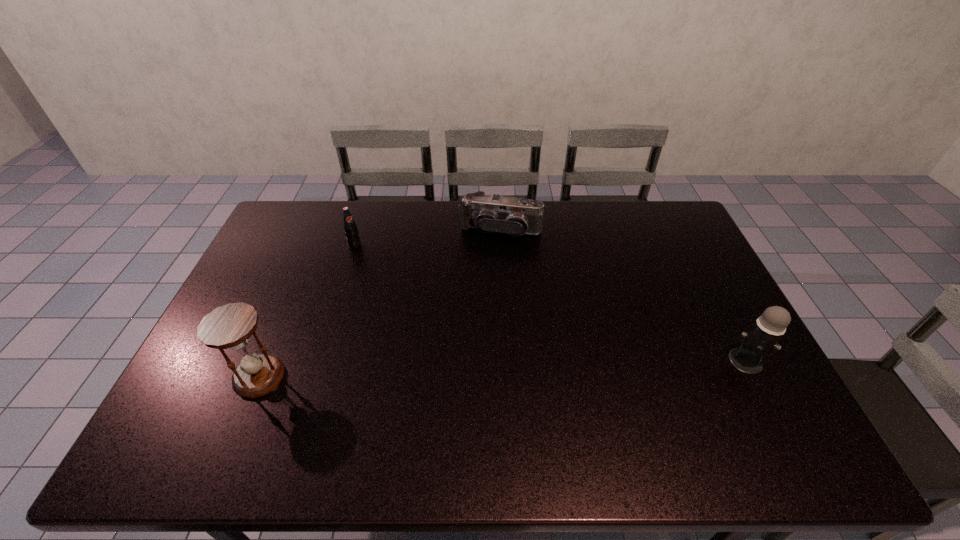
Where is `hourglass`? This screenshot has height=540, width=960. hourglass is located at coordinates (230, 326).

The width and height of the screenshot is (960, 540). I want to click on microphone, so click(762, 339).

Where is `the second object from right to left`? the second object from right to left is located at coordinates (488, 213).

Find the location of a particular element. the second object from left to right is located at coordinates (350, 227).

You are a GUI agent. You are given a task and a screenshot of the screen. Output one action in this format:
    pyautogui.click(x=<x>, y=<y>)
    Task: Click on the vacant area situated 0.090m on the right of the hourglass
    
    Given the screenshot: What is the action you would take?
    pyautogui.click(x=318, y=376)

Image resolution: width=960 pixels, height=540 pixels. In order to click on free region located on the left of the rightmost object in this screenshot , I will do `click(659, 361)`.

Image resolution: width=960 pixels, height=540 pixels. I want to click on vacant space situated on the front-facing side of the second object from right to left, so click(x=487, y=261).

In order to click on vacant position located on the front-facing side of the second object from right to left in this screenshot , I will do `click(480, 286)`.

Where is `free spot located on the front-facing side of the second object from right to left`? The width and height of the screenshot is (960, 540). free spot located on the front-facing side of the second object from right to left is located at coordinates (487, 261).

This screenshot has width=960, height=540. I want to click on vacant point located on the front label of the second object from left to right, so click(423, 312).